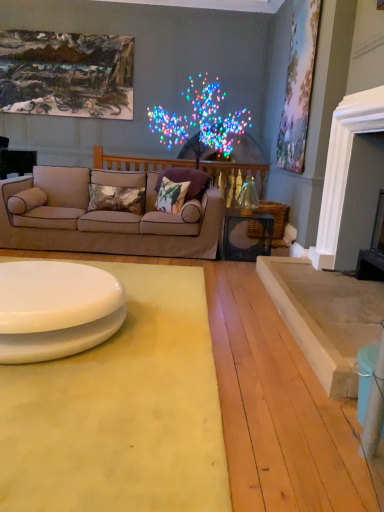
Question: Does pastel floral canvas at upper right, arranged as the first picture frame when viewed from the right, have a smaller size compared to beige fabric couch at center?

Choices:
 (A) yes
 (B) no

Answer: (A)

Question: Can you confirm if pastel floral canvas at upper right, arranged as the first picture frame when viewed from the right, is thinner than beige fabric couch at center?

Choices:
 (A) yes
 (B) no

Answer: (A)

Question: Is pastel floral canvas at upper right, the second picture frame when ordered from back to front, at the right side of beige fabric couch at center?

Choices:
 (A) no
 (B) yes

Answer: (B)

Question: Is pastel floral canvas at upper right, placed as the 1th picture frame when sorted from front to back, bigger than beige fabric couch at center?

Choices:
 (A) no
 (B) yes

Answer: (A)

Question: Is pastel floral canvas at upper right, arranged as the first picture frame when viewed from the right, positioned before beige fabric couch at center?

Choices:
 (A) no
 (B) yes

Answer: (A)

Question: Considering the positions of fluffy fabric pillow at center, the 1th pillow from the right, and yellow fabric mat at lower center in the image, is fluffy fabric pillow at center, the 1th pillow from the right, wider or thinner than yellow fabric mat at lower center?

Choices:
 (A) wide
 (B) thin

Answer: (B)

Question: Is point click(173, 172) positioned closer to the camera than point click(94, 498)?

Choices:
 (A) farther
 (B) closer

Answer: (A)

Question: From a real-world perspective, relative to yellow fabric mat at lower center, is fluffy fabric pillow at center, the 1th pillow from the right, vertically above or below?

Choices:
 (A) below
 (B) above

Answer: (B)

Question: In terms of size, does fluffy fabric pillow at center, which ranks as the fourth pillow in left-to-right order, appear bigger or smaller than yellow fabric mat at lower center?

Choices:
 (A) big
 (B) small

Answer: (B)

Question: From their relative heights in the image, would you say textured floral pillow at center, the third pillow in the right-to-left sequence, is taller or shorter than fluffy fabric pillow at center, the 1th pillow from the right?

Choices:
 (A) tall
 (B) short

Answer: (B)

Question: Is textured floral pillow at center, which is counted as the 2th pillow, starting from the left, bigger or smaller than fluffy fabric pillow at center, the 1th pillow from the right?

Choices:
 (A) big
 (B) small

Answer: (B)

Question: Choose the correct answer: Is textured floral pillow at center, which is counted as the 2th pillow, starting from the left, inside fluffy fabric pillow at center, the 1th pillow from the right, or outside it?

Choices:
 (A) inside
 (B) outside

Answer: (B)

Question: From a real-world perspective, is textured floral pillow at center, which is counted as the 2th pillow, starting from the left, above or below fluffy fabric pillow at center, which ranks as the fourth pillow in left-to-right order?

Choices:
 (A) above
 (B) below

Answer: (B)

Question: From a real-world perspective, is pastel floral canvas at upper right, placed as the 1th picture frame when sorted from front to back, positioned above or below floral-patterned fabric pillow at center, which is the 2th pillow in right-to-left order?

Choices:
 (A) below
 (B) above

Answer: (B)

Question: From the image's perspective, is pastel floral canvas at upper right, arranged as the first picture frame when viewed from the right, positioned above or below floral-patterned fabric pillow at center, which is the 2th pillow in right-to-left order?

Choices:
 (A) above
 (B) below

Answer: (A)